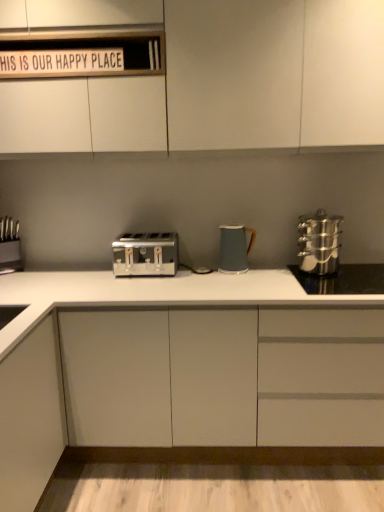
This screenshot has width=384, height=512. I want to click on unoccupied area in front of matte gray kettle at center, so click(235, 282).